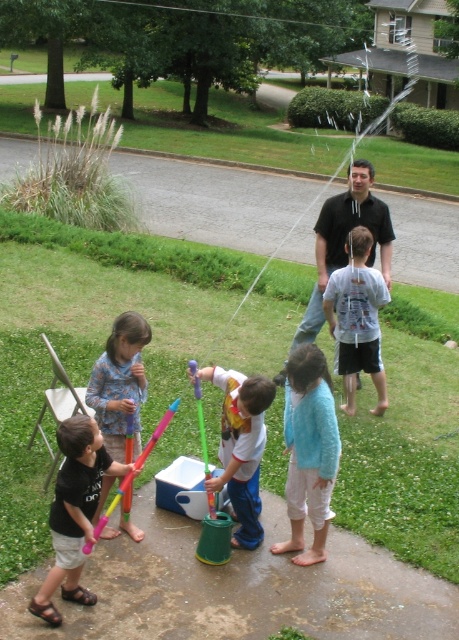
Is white matte shirt at center above floral fabric dress at lower left?

Yes.

Who is higher up, white matte shirt at center or floral fabric dress at lower left?

Positioned higher is white matte shirt at center.

Which is behind, point (358, 257) or point (85, 392)?

Positioned behind is point (358, 257).

At what (x,y) coordinates should I click in order to perform the action: click on white matte shirt at center. Please return your answer as a coordinate pair (x, y). Looking at the image, I should click on (358, 317).

Can you confirm if white cotton shirt at center is shorter than floral fabric dress at lower left?

Yes.

Which is more to the left, white cotton shirt at center or floral fabric dress at lower left?

floral fabric dress at lower left

Between point (228, 420) and point (100, 358), which one is positioned behind?

The point (100, 358) is more distant.

You are a GUI agent. You are given a task and a screenshot of the screen. Output one action in this format:
    pyautogui.click(x=<x>, y=<y>)
    Task: Click on the white cotton shirt at center
    The height and width of the screenshot is (640, 459).
    Given the screenshot: What is the action you would take?
    pyautogui.click(x=241, y=445)

Where is `matte black shirt at lower left`? The width and height of the screenshot is (459, 640). matte black shirt at lower left is located at coordinates (73, 512).

Is matte black shirt at lower left above floral fabric dress at lower left?

No, matte black shirt at lower left is not above floral fabric dress at lower left.

This screenshot has width=459, height=640. What are the coordinates of `matte black shirt at lower left` in the screenshot? It's located at (73, 512).